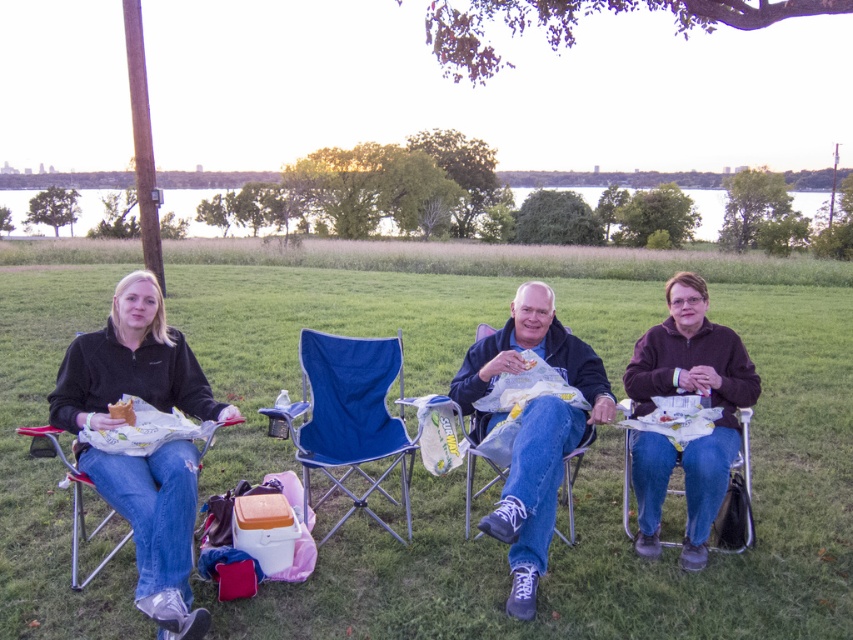
Who is more distant from viewer, (741, 483) or (119, 401)?

Point (741, 483)

Can you confirm if blue fabric chair at lower right is positioned to the right of golden crispy chicken at left?

Correct, you'll find blue fabric chair at lower right to the right of golden crispy chicken at left.

Between point (744, 417) and point (132, 419), which one is positioned in front?

Point (132, 419)

The image size is (853, 640). I want to click on blue fabric chair at lower right, so click(x=744, y=486).

Consider the image. Which is below, blue fabric folding chair at center or golden crispy chicken at left?

blue fabric folding chair at center

Does blue fabric folding chair at center have a greater width compared to golden crispy chicken at left?

Yes, blue fabric folding chair at center is wider than golden crispy chicken at left.

Image resolution: width=853 pixels, height=640 pixels. I want to click on blue fabric folding chair at center, so click(350, 417).

Looking at this image, does dark blue fabric jacket at center lie in front of blue fabric folding chair at center?

Yes.

Between point (550, 301) and point (331, 413), which one is positioned behind?

Point (331, 413)

Between point (511, 330) and point (343, 340), which one is positioned behind?

The point (343, 340) is more distant.

This screenshot has height=640, width=853. In order to click on dark blue fabric jacket at center in this screenshot , I will do `click(532, 429)`.